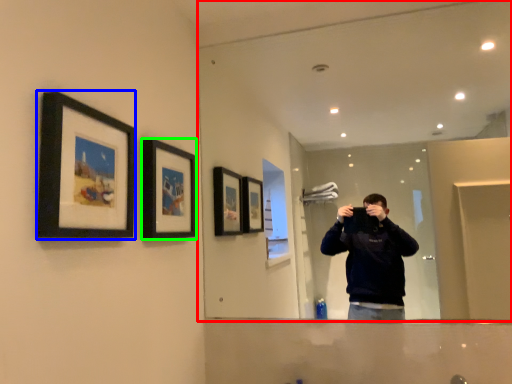
Question: Considering the real-world distances, which object is farthest from mirror (highlighted by a red box)? picture frame (highlighted by a blue box) or picture frame (highlighted by a green box)?

Choices:
 (A) picture frame
 (B) picture frame

Answer: (A)